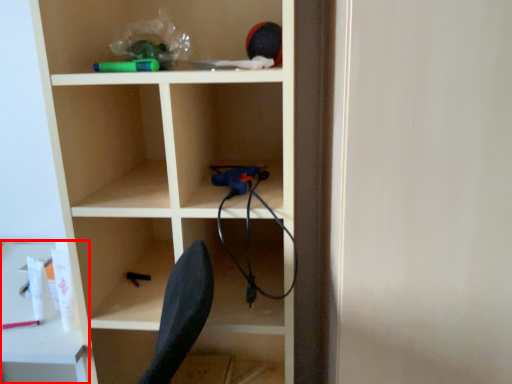
Question: Observing the image, what is the correct spatial positioning of table (annotated by the red box) in reference to shelf?

Choices:
 (A) right
 (B) left

Answer: (B)